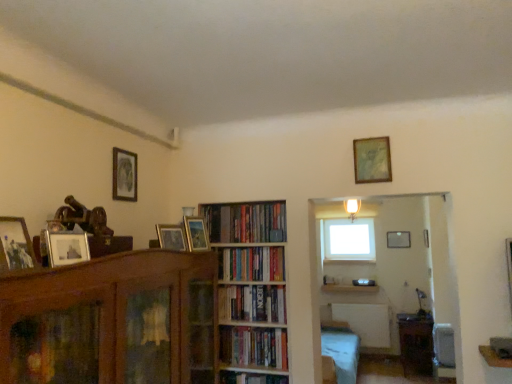
Question: Could you tell me if wooden picture frame at center, which appears as the third picture frame when ordered from the bottom, is turned towards wooden table at lower right?

Choices:
 (A) yes
 (B) no

Answer: (B)

Question: Is wooden picture frame at center, arranged as the third picture frame when viewed from the right, further to camera compared to wooden table at lower right?

Choices:
 (A) yes
 (B) no

Answer: (B)

Question: From a real-world perspective, does wooden picture frame at center, which ranks as the fourth picture frame in top-to-bottom order, sit lower than wooden table at lower right?

Choices:
 (A) no
 (B) yes

Answer: (A)

Question: From the image's perspective, is wooden picture frame at center, arranged as the third picture frame when viewed from the right, under wooden table at lower right?

Choices:
 (A) yes
 (B) no

Answer: (B)

Question: Does wooden picture frame at center, which ranks as the fourth picture frame in top-to-bottom order, have a lesser height compared to wooden table at lower right?

Choices:
 (A) no
 (B) yes

Answer: (B)

Question: Considering the positions of hardcover books at center, which ranks as the first book in bottom-to-top order, and hardcover books at center, the 2th book from the bottom, in the image, is hardcover books at center, which ranks as the first book in bottom-to-top order, bigger or smaller than hardcover books at center, the 2th book from the bottom,?

Choices:
 (A) small
 (B) big

Answer: (B)

Question: From the image's perspective, is hardcover books at center, which ranks as the first book in bottom-to-top order, located above or below hardcover books at center, which appears as the third book when viewed from the top?

Choices:
 (A) above
 (B) below

Answer: (B)

Question: From their relative heights in the image, would you say hardcover books at center, which appears as the 4th book when viewed from the top, is taller or shorter than hardcover books at center, the 2th book from the bottom?

Choices:
 (A) tall
 (B) short

Answer: (A)

Question: Is hardcover books at center, which ranks as the first book in bottom-to-top order, in front of or behind hardcover books at center, which appears as the third book when viewed from the top, in the image?

Choices:
 (A) behind
 (B) front

Answer: (B)

Question: In terms of height, does wooden picture frame at center, arranged as the 5th picture frame when viewed from the top, look taller or shorter compared to wooden bookshelf at center?

Choices:
 (A) tall
 (B) short

Answer: (B)

Question: Considering the relative positions of wooden picture frame at center, which ranks as the 5th picture frame in back-to-front order, and wooden bookshelf at center in the image provided, is wooden picture frame at center, which ranks as the 5th picture frame in back-to-front order, to the left or to the right of wooden bookshelf at center?

Choices:
 (A) left
 (B) right

Answer: (A)

Question: From a real-world perspective, is wooden picture frame at center, which is counted as the 2th picture frame, starting from the bottom, physically located above or below wooden bookshelf at center?

Choices:
 (A) below
 (B) above

Answer: (B)

Question: In the image, is wooden picture frame at center, arranged as the 5th picture frame when viewed from the top, positioned in front of or behind wooden bookshelf at center?

Choices:
 (A) front
 (B) behind

Answer: (A)

Question: Would you say hardcover books at center, the 2th book from the bottom, is inside or outside wooden bookshelf at center?

Choices:
 (A) inside
 (B) outside

Answer: (A)

Question: Does point (240, 304) appear closer or farther from the camera than point (234, 327)?

Choices:
 (A) farther
 (B) closer

Answer: (A)